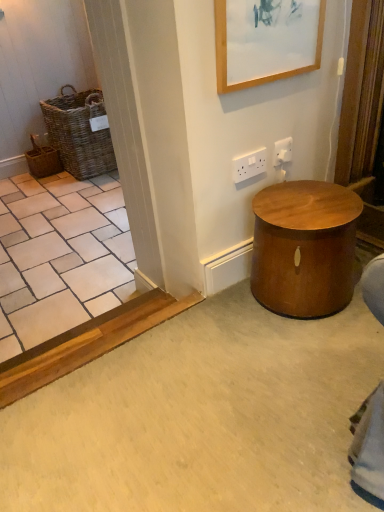
Question: Based on their positions, is woven brown basket at left, which is the 1th basket in left-to-right order, located to the left or right of wooden picture frame at upper center?

Choices:
 (A) right
 (B) left

Answer: (B)

Question: From the image's perspective, is woven brown basket at left, arranged as the 2th basket when viewed from the right, above or below wooden picture frame at upper center?

Choices:
 (A) above
 (B) below

Answer: (A)

Question: Based on their relative distances, which object is nearer to the woven brown basket at left, arranged as the 2th basket when viewed from the right?

Choices:
 (A) white plastic electric outlet at upper right, acting as the 1th electric outlet starting from the right
 (B) woven brown basket at left, the second basket positioned from the left
 (C) shiny brown stool at lower right
 (D) white plastic electric outlet at upper center, marked as the second electric outlet in a right-to-left arrangement
 (E) wooden picture frame at upper center

Answer: (B)

Question: Which of these objects is positioned farthest from the white plastic electric outlet at upper right, acting as the 1th electric outlet starting from the right?

Choices:
 (A) shiny brown stool at lower right
 (B) woven brown basket at left, positioned as the 1th basket in right-to-left order
 (C) white plastic electric outlet at upper center, marked as the second electric outlet in a right-to-left arrangement
 (D) wooden picture frame at upper center
 (E) woven brown basket at left, which is the 1th basket in left-to-right order

Answer: (E)